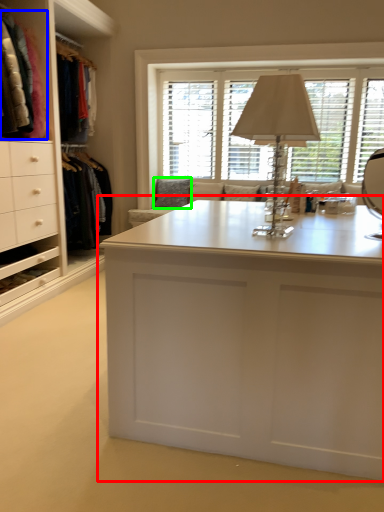
Question: Based on their relative distances, which object is nearer to desk (highlighted by a red box)? Choose from clothing (highlighted by a blue box) and pillow (highlighted by a green box).

Choices:
 (A) clothing
 (B) pillow

Answer: (A)